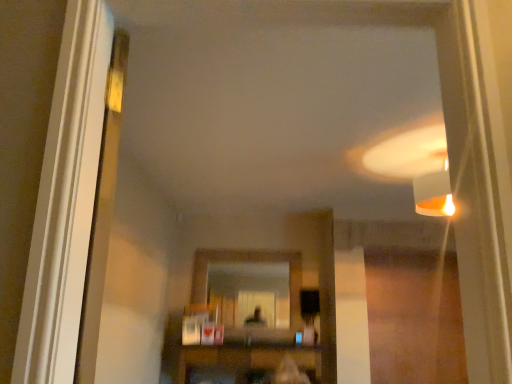
The image size is (512, 384). What do you see at coordinates (245, 358) in the screenshot?
I see `wooden shelf at center` at bounding box center [245, 358].

The image size is (512, 384). Find the location of `wooden shelf at center`. wooden shelf at center is located at coordinates (245, 358).

What do you see at coordinates (250, 292) in the screenshot?
I see `matte glass mirror at center` at bounding box center [250, 292].

Image resolution: width=512 pixels, height=384 pixels. In order to click on matte glass mirror at center in this screenshot , I will do `click(250, 292)`.

Locate an element on the screen. Image resolution: width=512 pixels, height=384 pixels. wooden shelf at center is located at coordinates (245, 358).

Between matte glass mirror at center and wooden shelf at center, which one appears on the left side from the viewer's perspective?

Positioned to the left is matte glass mirror at center.

Considering the relative positions of matte glass mirror at center and wooden shelf at center in the image provided, is matte glass mirror at center in front of wooden shelf at center?

No, matte glass mirror at center is behind wooden shelf at center.

Between point (229, 301) and point (204, 362), which one is positioned in front?

The point (204, 362) is closer.

From the image's perspective, does matte glass mirror at center appear higher than wooden shelf at center?

Yes, from the image's perspective, matte glass mirror at center is on top of wooden shelf at center.

From a real-world perspective, between matte glass mirror at center and wooden shelf at center, who is vertically lower?

wooden shelf at center, from a real-world perspective.

Looking at their sizes, would you say matte glass mirror at center is wider or thinner than wooden shelf at center?

Considering their sizes, matte glass mirror at center looks slimmer than wooden shelf at center.

Looking at this image, does matte glass mirror at center have a greater height compared to wooden shelf at center?

Yes, matte glass mirror at center is taller than wooden shelf at center.

In the scene shown: Is matte glass mirror at center bigger than wooden shelf at center?

Incorrect, matte glass mirror at center is not larger than wooden shelf at center.

Is matte glass mirror at center outside of wooden shelf at center?

Yes, matte glass mirror at center is outside of wooden shelf at center.

Would you consider matte glass mirror at center to be distant from wooden shelf at center?

matte glass mirror at center is far away from wooden shelf at center.

Could you tell me if matte glass mirror at center is facing wooden shelf at center?

No, matte glass mirror at center is not facing towards wooden shelf at center.

From the picture: Can you tell me how much matte glass mirror at center and wooden shelf at center differ in facing direction?

There is a 1.32-degree angle between the facing directions of matte glass mirror at center and wooden shelf at center.

Find the location of a particular element. The height and width of the screenshot is (384, 512). mirror that is behind the wooden shelf at center is located at coordinates (250, 292).

Which object is positioned more to the right, wooden shelf at center or matte glass mirror at center?

From the viewer's perspective, wooden shelf at center appears more on the right side.

Considering the relative positions of wooden shelf at center and matte glass mirror at center in the image provided, is wooden shelf at center behind matte glass mirror at center?

That is False.

Which point is more distant from viewer, (x=185, y=368) or (x=228, y=320)?

Positioned behind is point (x=228, y=320).

From the image's perspective, which is above, wooden shelf at center or matte glass mirror at center?

matte glass mirror at center.

From a real-world perspective, does wooden shelf at center sit lower than matte glass mirror at center?

Yes.

Considering the sizes of objects wooden shelf at center and matte glass mirror at center in the image provided, who is wider, wooden shelf at center or matte glass mirror at center?

wooden shelf at center is wider.

Which of these two, wooden shelf at center or matte glass mirror at center, stands shorter?

wooden shelf at center.

Considering the sizes of wooden shelf at center and matte glass mirror at center in the image, is wooden shelf at center bigger or smaller than matte glass mirror at center?

wooden shelf at center is bigger than matte glass mirror at center.

Is wooden shelf at center completely or partially outside of matte glass mirror at center?

Yes, wooden shelf at center is not within matte glass mirror at center.

Is wooden shelf at center placed right next to matte glass mirror at center?

They are not placed beside each other.

Could you tell me if wooden shelf at center is facing matte glass mirror at center?

No.

How many degrees apart are the facing directions of wooden shelf at center and matte glass mirror at center?

The facing directions of wooden shelf at center and matte glass mirror at center are 1.32 degrees apart.

This screenshot has height=384, width=512. What are the coordinates of `mirror behind the wooden shelf at center` in the screenshot? It's located at (250, 292).

The height and width of the screenshot is (384, 512). Find the location of `furniture on the right of matte glass mirror at center`. furniture on the right of matte glass mirror at center is located at coordinates (245, 358).

Find the location of a particular element. This screenshot has width=512, height=384. mirror behind the wooden shelf at center is located at coordinates (250, 292).